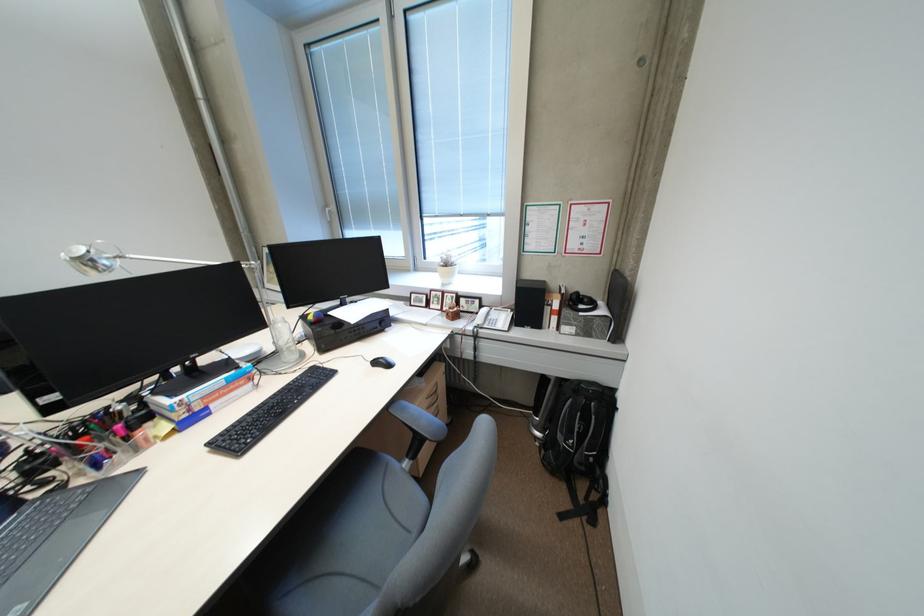
You are a GUI agent. You are given a task and a screenshot of the screen. Output one action in this format:
    pyautogui.click(x=<x>, y=<y>)
    Task: Click on the white window handle
    The height and width of the screenshot is (616, 924).
    Given the screenshot: What is the action you would take?
    pyautogui.click(x=332, y=209)